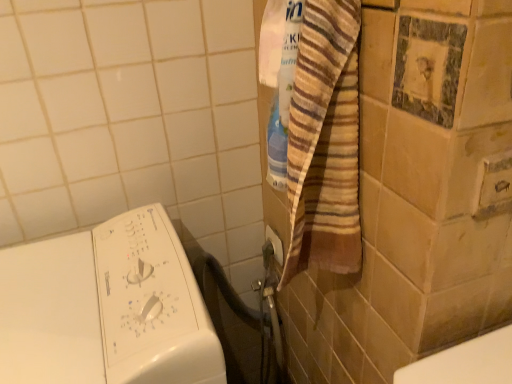
You are a GUI agent. You are given a task and a screenshot of the screen. Output one action in this format:
    pyautogui.click(x=<x>, y=<y>)
    Task: Click on the metallic silver plug at lower center
    The height and width of the screenshot is (384, 512).
    Given the screenshot: What is the action you would take?
    pyautogui.click(x=275, y=244)

In order to face metallic silver plug at lower center, should I rotate leftwards or rightwards?

Rotate right and turn 2.557 degrees.

Image resolution: width=512 pixels, height=384 pixels. What do you see at coordinates (275, 244) in the screenshot?
I see `metallic silver plug at lower center` at bounding box center [275, 244].

This screenshot has width=512, height=384. Describe the element at coordinates (105, 308) in the screenshot. I see `white glossy washing machine at upper left` at that location.

The width and height of the screenshot is (512, 384). Identify the location of white glossy washing machine at upper left. (105, 308).

Locate an element on the screen. metallic silver plug at lower center is located at coordinates (275, 244).

Can you confirm if white glossy washing machine at upper left is positioned to the left of metallic silver plug at lower center?

Yes, white glossy washing machine at upper left is to the left of metallic silver plug at lower center.

Is the position of white glossy washing machine at upper left more distant than that of metallic silver plug at lower center?

No, white glossy washing machine at upper left is closer to the camera.

Which is less distant, [145,343] or [282,264]?

Point [145,343] is closer to the camera than point [282,264].

From the image's perspective, which is below, white glossy washing machine at upper left or metallic silver plug at lower center?

From the image's view, white glossy washing machine at upper left is below.

From a real-world perspective, who is located lower, white glossy washing machine at upper left or metallic silver plug at lower center?

In real-world perspective, white glossy washing machine at upper left is lower.

Considering the relative sizes of white glossy washing machine at upper left and metallic silver plug at lower center in the image provided, is white glossy washing machine at upper left wider than metallic silver plug at lower center?

Yes, white glossy washing machine at upper left is wider than metallic silver plug at lower center.

From their relative heights in the image, would you say white glossy washing machine at upper left is taller or shorter than metallic silver plug at lower center?

white glossy washing machine at upper left is taller than metallic silver plug at lower center.

Does white glossy washing machine at upper left have a smaller size compared to metallic silver plug at lower center?

No.

In the scene shown: Is white glossy washing machine at upper left not inside metallic silver plug at lower center?

white glossy washing machine at upper left is positioned outside metallic silver plug at lower center.

Is the surface of white glossy washing machine at upper left in direct contact with metallic silver plug at lower center?

white glossy washing machine at upper left and metallic silver plug at lower center are not in contact.

Could you tell me if white glossy washing machine at upper left is turned towards metallic silver plug at lower center?

No.

In the image, there is a metallic silver plug at lower center. Where is `washing machine below it (from a real-world perspective)`? washing machine below it (from a real-world perspective) is located at coordinates pos(105,308).

Which object is positioned more to the left, metallic silver plug at lower center or white glossy washing machine at upper left?

Positioned to the left is white glossy washing machine at upper left.

In the image, is metallic silver plug at lower center positioned in front of or behind white glossy washing machine at upper left?

metallic silver plug at lower center is behind white glossy washing machine at upper left.

Does point (281, 244) lie behind point (52, 343)?

Yes, point (281, 244) is behind point (52, 343).

From the image's perspective, is metallic silver plug at lower center located beneath white glossy washing machine at upper left?

Actually, metallic silver plug at lower center appears above white glossy washing machine at upper left in the image.

From a real-world perspective, does metallic silver plug at lower center sit lower than white glossy washing machine at upper left?

No, from a real-world perspective, metallic silver plug at lower center is not under white glossy washing machine at upper left.

Which of these two, metallic silver plug at lower center or white glossy washing machine at upper left, is thinner?

Thinner between the two is metallic silver plug at lower center.

Between metallic silver plug at lower center and white glossy washing machine at upper left, which one has less height?

metallic silver plug at lower center.

From the picture: Who is bigger, metallic silver plug at lower center or white glossy washing machine at upper left?

With larger size is white glossy washing machine at upper left.

Is metallic silver plug at lower center inside or outside of white glossy washing machine at upper left?

metallic silver plug at lower center cannot be found inside white glossy washing machine at upper left.

Based on the photo, is metallic silver plug at lower center next to white glossy washing machine at upper left?

No, metallic silver plug at lower center is not in contact with white glossy washing machine at upper left.

Is white glossy washing machine at upper left at the back of metallic silver plug at lower center?

metallic silver plug at lower center does not have its back to white glossy washing machine at upper left.

Can you tell me how much metallic silver plug at lower center and white glossy washing machine at upper left differ in facing direction?

The facing directions of metallic silver plug at lower center and white glossy washing machine at upper left are 0.00752 degrees apart.

Where is `washing machine in front of the metallic silver plug at lower center`? This screenshot has height=384, width=512. washing machine in front of the metallic silver plug at lower center is located at coordinates (105, 308).

The height and width of the screenshot is (384, 512). I want to click on washing machine below the metallic silver plug at lower center (from a real-world perspective), so click(105, 308).

You are a GUI agent. You are given a task and a screenshot of the screen. Output one action in this format:
    pyautogui.click(x=<x>, y=<y>)
    Task: Click on the electric outlet to the right of white glossy washing machine at upper left
    The image size is (512, 384).
    Given the screenshot: What is the action you would take?
    (x=275, y=244)